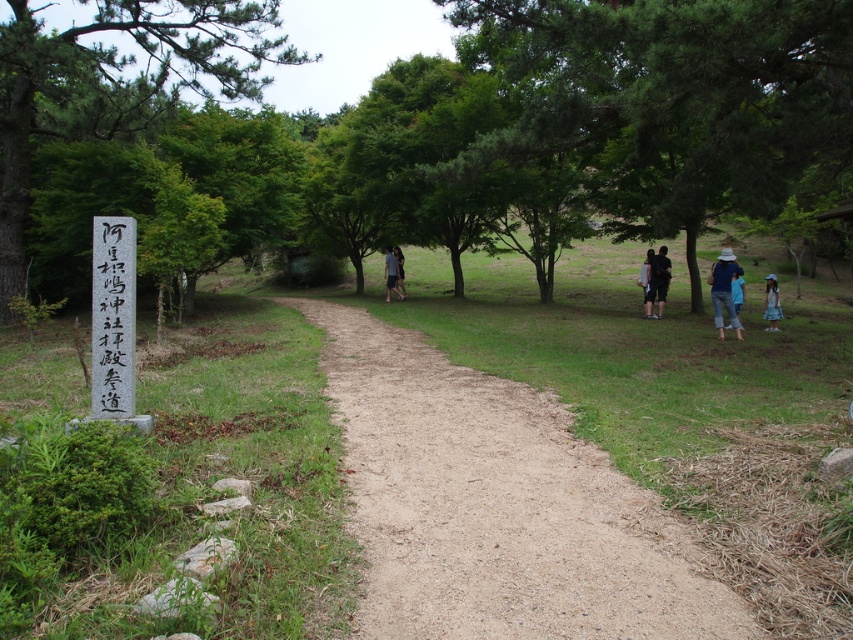
Question: Among these objects, which one is farthest from the camera?

Choices:
 (A) blue cotton shirt at right
 (B) denim hat at right
 (C) white wood sign at left

Answer: (A)

Question: Is denim hat at right further to camera compared to dress fabric at right?

Choices:
 (A) yes
 (B) no

Answer: (B)

Question: Is white wood sign at left to the right of dark gray pants at center right from the viewer's perspective?

Choices:
 (A) no
 (B) yes

Answer: (A)

Question: Which point is closer to the camera?

Choices:
 (A) denim hat at right
 (B) green leafy tree at left
 (C) white wood sign at left
 (D) green leafy tree at right

Answer: (C)

Question: Which of these objects is positioned closest to the dress fabric at right?

Choices:
 (A) denim hat at right
 (B) white wood sign at left
 (C) blue cotton shirt at right

Answer: (C)

Question: Does white wood sign at left have a greater width compared to dark gray fabric pants at center?

Choices:
 (A) no
 (B) yes

Answer: (A)